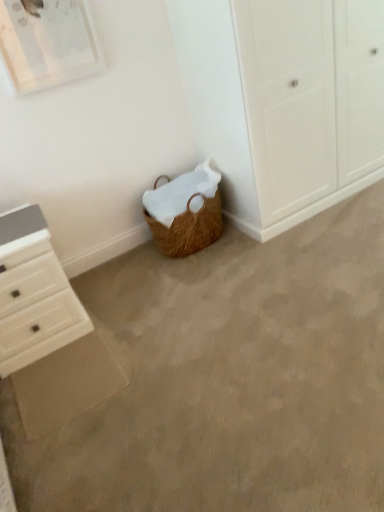
This screenshot has width=384, height=512. Describe the element at coordinates (229, 378) in the screenshot. I see `braided wicker basket at lower center` at that location.

Identify the location of braided wicker basket at lower center. This screenshot has width=384, height=512. (229, 378).

Locate an element on the screen. white wood chest of drawers at lower left is located at coordinates (33, 293).

This screenshot has width=384, height=512. What do you see at coordinates (33, 293) in the screenshot?
I see `white wood chest of drawers at lower left` at bounding box center [33, 293].

Image resolution: width=384 pixels, height=512 pixels. In order to click on braided wicker basket at lower center in this screenshot , I will do point(229,378).

Which is more to the left, white wood chest of drawers at lower left or braided wicker basket at lower center?

white wood chest of drawers at lower left.

Between white wood chest of drawers at lower left and braided wicker basket at lower center, which one is positioned in front?

Positioned in front is braided wicker basket at lower center.

Is point (3, 298) closer or farther from the camera than point (321, 335)?

Clearly, point (3, 298) is more distant from the camera than point (321, 335).

From the image's perspective, does white wood chest of drawers at lower left appear higher than braided wicker basket at lower center?

Yes, from the image's perspective, white wood chest of drawers at lower left is above braided wicker basket at lower center.

From a real-world perspective, is white wood chest of drawers at lower left beneath braided wicker basket at lower center?

Incorrect, from a real-world perspective, white wood chest of drawers at lower left is higher than braided wicker basket at lower center.

Between white wood chest of drawers at lower left and braided wicker basket at lower center, which one has smaller width?

white wood chest of drawers at lower left.

Can you confirm if white wood chest of drawers at lower left is taller than braided wicker basket at lower center?

Yes, white wood chest of drawers at lower left is taller than braided wicker basket at lower center.

Can you confirm if white wood chest of drawers at lower left is smaller than braided wicker basket at lower center?

Indeed, white wood chest of drawers at lower left has a smaller size compared to braided wicker basket at lower center.

Is braided wicker basket at lower center inside white wood chest of drawers at lower left?

That's incorrect, braided wicker basket at lower center is not inside white wood chest of drawers at lower left.

In the scene shown: Would you say white wood chest of drawers at lower left is a long distance from braided wicker basket at lower center?

No, white wood chest of drawers at lower left is not far away from braided wicker basket at lower center.

Is white wood chest of drawers at lower left oriented towards braided wicker basket at lower center?

No, white wood chest of drawers at lower left is not aimed at braided wicker basket at lower center.

Can you tell me how much white wood chest of drawers at lower left and braided wicker basket at lower center differ in facing direction?

They differ by 1.22 degrees in their facing directions.

Where is `chest of drawers above the braided wicker basket at lower center (from a real-world perspective)`? The image size is (384, 512). chest of drawers above the braided wicker basket at lower center (from a real-world perspective) is located at coordinates (33, 293).

Is braided wicker basket at lower center at the right side of white wood chest of drawers at lower left?

Yes, braided wicker basket at lower center is to the right of white wood chest of drawers at lower left.

Consider the image. Is braided wicker basket at lower center further to camera compared to white wood chest of drawers at lower left?

No, braided wicker basket at lower center is closer to the camera.

Which is farther from the camera, (x=144, y=276) or (x=29, y=289)?

Point (x=144, y=276)

From the image's perspective, is braided wicker basket at lower center positioned above or below white wood chest of drawers at lower left?

Clearly, from the image's perspective, braided wicker basket at lower center is below white wood chest of drawers at lower left.

From a real-world perspective, is braided wicker basket at lower center located higher than white wood chest of drawers at lower left?

Actually, braided wicker basket at lower center is physically below white wood chest of drawers at lower left in the real world.

In terms of width, does braided wicker basket at lower center look wider or thinner when compared to white wood chest of drawers at lower left?

Clearly, braided wicker basket at lower center has more width compared to white wood chest of drawers at lower left.

In terms of height, does braided wicker basket at lower center look taller or shorter compared to white wood chest of drawers at lower left?

braided wicker basket at lower center is shorter than white wood chest of drawers at lower left.

Between braided wicker basket at lower center and white wood chest of drawers at lower left, which one has larger size?

With larger size is braided wicker basket at lower center.

Is braided wicker basket at lower center not within white wood chest of drawers at lower left?

Indeed, braided wicker basket at lower center is completely outside white wood chest of drawers at lower left.

Is braided wicker basket at lower center not near white wood chest of drawers at lower left?

No, braided wicker basket at lower center is in close proximity to white wood chest of drawers at lower left.

Is braided wicker basket at lower center facing away from white wood chest of drawers at lower left?

No, white wood chest of drawers at lower left is not at the back of braided wicker basket at lower center.

How different are the orientations of braided wicker basket at lower center and white wood chest of drawers at lower left in degrees?

The angular difference between braided wicker basket at lower center and white wood chest of drawers at lower left is 1.22 degrees.

How distant is braided wicker basket at lower center from white wood chest of drawers at lower left?

24.72 inches.

Find the location of a particular element. This screenshot has width=384, height=512. the chest of drawers that appears behind the braided wicker basket at lower center is located at coordinates (33, 293).

You are a GUI agent. You are given a task and a screenshot of the screen. Output one action in this format:
    pyautogui.click(x=<x>, y=<y>)
    Task: Click on the concrete that appears in front of the white wood chest of drawers at lower left
    
    Given the screenshot: What is the action you would take?
    229,378

Where is `the chest of drawers above the braided wicker basket at lower center (from a real-world perspective)`? Image resolution: width=384 pixels, height=512 pixels. the chest of drawers above the braided wicker basket at lower center (from a real-world perspective) is located at coordinates (33, 293).